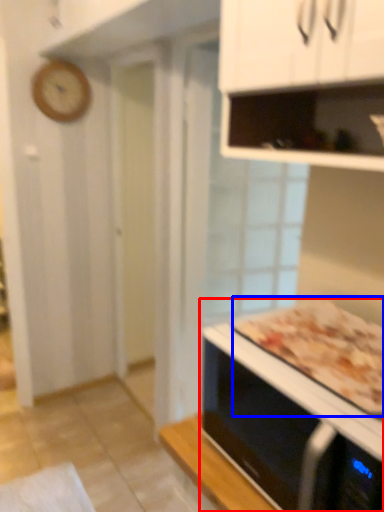
Question: Which object is closer to the camera taking this photo, microwave oven (highlighted by a red box) or pizza (highlighted by a blue box)?

Choices:
 (A) microwave oven
 (B) pizza

Answer: (A)